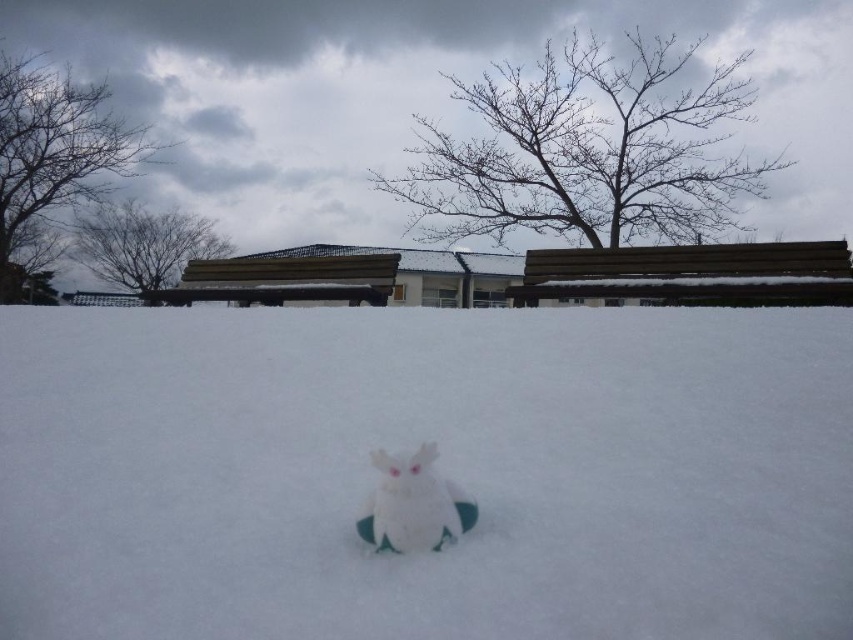
Between white fluffy snow at center and white fabric snowman at center, which one has more height?

white fluffy snow at center

Which is above, white fluffy snow at center or white fabric snowman at center?

white fluffy snow at center

The height and width of the screenshot is (640, 853). Find the location of `white fluffy snow at center`. white fluffy snow at center is located at coordinates (440, 465).

Is wooden bench at upper right in front of white fabric snowman at center?

No, wooden bench at upper right is behind white fabric snowman at center.

Between point (631, 276) and point (405, 547), which one is positioned behind?

The point (631, 276) is behind.

The width and height of the screenshot is (853, 640). What do you see at coordinates (692, 273) in the screenshot?
I see `wooden bench at upper right` at bounding box center [692, 273].

Locate an element on the screen. wooden bench at upper right is located at coordinates (692, 273).

Can you confirm if white fluffy snow at center is positioned above wooden bench at upper right?

Actually, white fluffy snow at center is below wooden bench at upper right.

The height and width of the screenshot is (640, 853). What are the coordinates of `white fluffy snow at center` in the screenshot? It's located at (440, 465).